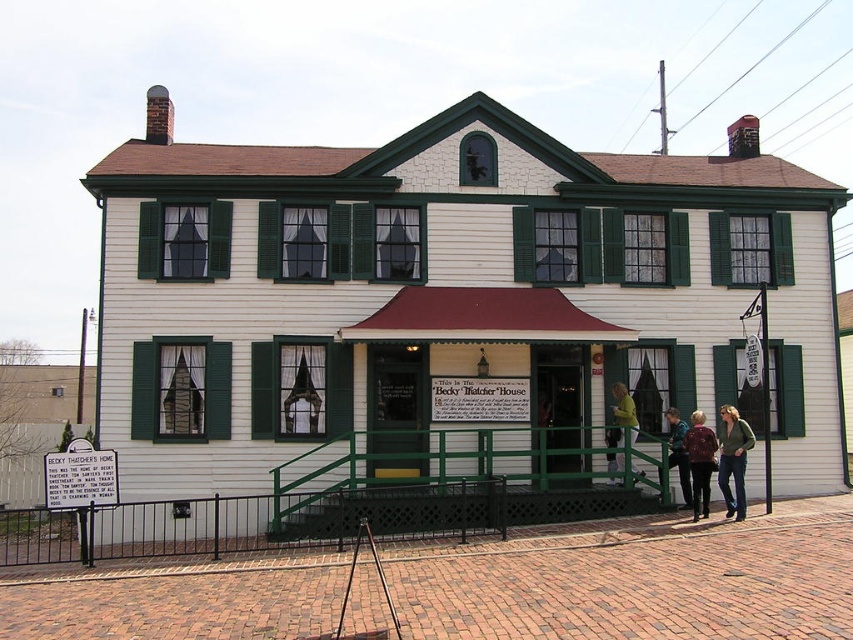
Between point (741, 419) and point (625, 432), which one is positioned in front?

Positioned in front is point (625, 432).

Which is below, green cotton shirt at center or yellow fabric at center?

Positioned lower is green cotton shirt at center.

Image resolution: width=853 pixels, height=640 pixels. I want to click on green cotton shirt at center, so click(733, 460).

Who is higher up, yellow fabric at center or matte green jacket at lower right?

yellow fabric at center is higher up.

Between yellow fabric at center and matte green jacket at lower right, which one is positioned lower?

matte green jacket at lower right is lower down.

The height and width of the screenshot is (640, 853). Find the location of `yellow fabric at center`. yellow fabric at center is located at coordinates (624, 416).

Who is shorter, white wood house at center or yellow fabric at center?

yellow fabric at center

This screenshot has height=640, width=853. What do you see at coordinates (453, 308) in the screenshot?
I see `white wood house at center` at bounding box center [453, 308].

Based on the photo, measure the distance between white wood house at center and camera.

white wood house at center is 72.45 feet from camera.

You are a GUI agent. You are given a task and a screenshot of the screen. Output one action in this format:
    pyautogui.click(x=<x>, y=<y>)
    Task: Click on the white wood house at center
    
    Given the screenshot: What is the action you would take?
    pyautogui.click(x=453, y=308)